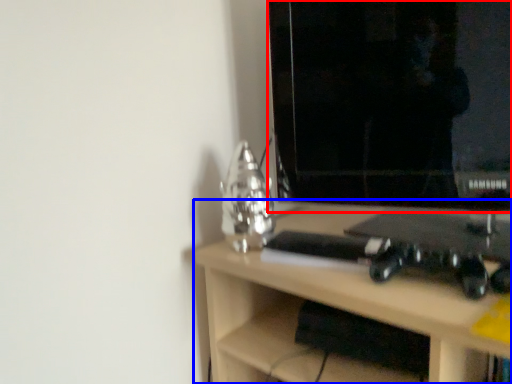
Question: Which of the following is the closest to the observer, computer monitor (highlighted by a red box) or desk (highlighted by a blue box)?

Choices:
 (A) computer monitor
 (B) desk

Answer: (B)